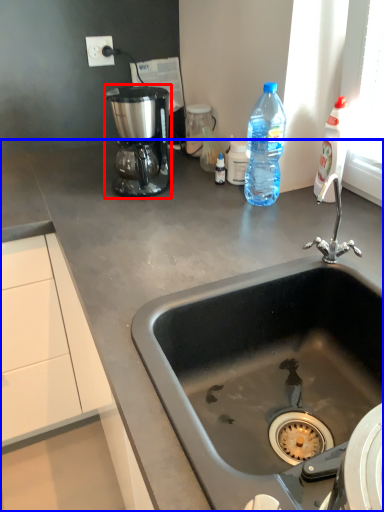
Question: Which object appears closest to the camera in this image, coffee maker (highlighted by a red box) or countertop (highlighted by a blue box)?

Choices:
 (A) coffee maker
 (B) countertop

Answer: (B)